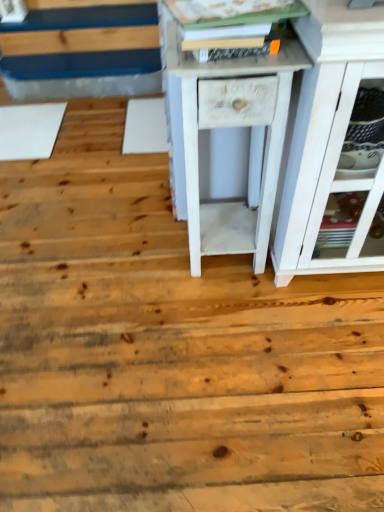
You are a GUI agent. You are given a task and a screenshot of the screen. Output one action in this format:
    pyautogui.click(x=<x>, y=<y>)
    Task: Click on the white matte nightstand at center
    
    Given the screenshot: What is the action you would take?
    (227, 125)

The width and height of the screenshot is (384, 512). Describe the element at coordinates (227, 125) in the screenshot. I see `white matte nightstand at center` at that location.

I want to click on white painted wood cabinet at right, so click(329, 142).

This screenshot has width=384, height=512. Describe the element at coordinates (329, 142) in the screenshot. I see `white painted wood cabinet at right` at that location.

Find the location of a particular element. The image size is (384, 512). white matte nightstand at center is located at coordinates (227, 125).

Can you confirm if white painted wood cabinet at right is positioned to the left of white matte nightstand at center?

No, white painted wood cabinet at right is not to the left of white matte nightstand at center.

Is the position of white painted wood cabinet at right more distant than that of white matte nightstand at center?

No, it is in front of white matte nightstand at center.

Is point (288, 188) positioned before point (190, 53)?

No.

From the image's perspective, which one is positioned lower, white painted wood cabinet at right or white matte nightstand at center?

From the image's view, white matte nightstand at center is below.

From a real-world perspective, is white painted wood cabinet at right on white matte nightstand at center?

Yes, from a real-world perspective, white painted wood cabinet at right is on top of white matte nightstand at center.

Considering the relative sizes of white painted wood cabinet at right and white matte nightstand at center in the image provided, is white painted wood cabinet at right wider than white matte nightstand at center?

Yes, white painted wood cabinet at right is wider than white matte nightstand at center.

Considering the relative sizes of white painted wood cabinet at right and white matte nightstand at center in the image provided, is white painted wood cabinet at right shorter than white matte nightstand at center?

No.

Which of these two, white painted wood cabinet at right or white matte nightstand at center, is bigger?

white painted wood cabinet at right is bigger.

Is white painted wood cabinet at right outside of white matte nightstand at center?

Yes, white painted wood cabinet at right is located beyond the bounds of white matte nightstand at center.

Is white painted wood cabinet at right placed right next to white matte nightstand at center?

No, white painted wood cabinet at right is not beside white matte nightstand at center.

Is white painted wood cabinet at right turned away from white matte nightstand at center?

white painted wood cabinet at right is not turned away from white matte nightstand at center.

Can you tell me how much white painted wood cabinet at right and white matte nightstand at center differ in facing direction?

There is a 0.000612-degree angle between the facing directions of white painted wood cabinet at right and white matte nightstand at center.

In order to click on nightstand behind the white painted wood cabinet at right in this screenshot , I will do `click(227, 125)`.

Considering the relative positions of white matte nightstand at center and white painted wood cabinet at right in the image provided, is white matte nightstand at center to the right of white painted wood cabinet at right from the viewer's perspective?

In fact, white matte nightstand at center is to the left of white painted wood cabinet at right.

Which object is further away from the camera taking this photo, white matte nightstand at center or white painted wood cabinet at right?

Positioned behind is white matte nightstand at center.

Which point is more distant from viewer, (x=225, y=13) or (x=328, y=269)?

Answer: The point (x=328, y=269) is farther.

From the image's perspective, who appears lower, white matte nightstand at center or white painted wood cabinet at right?

white matte nightstand at center is shown below in the image.

From a real-world perspective, which is physically above, white matte nightstand at center or white painted wood cabinet at right?

white painted wood cabinet at right is physically above.

Considering the sizes of objects white matte nightstand at center and white painted wood cabinet at right in the image provided, who is wider, white matte nightstand at center or white painted wood cabinet at right?

With larger width is white painted wood cabinet at right.

Can you confirm if white matte nightstand at center is shorter than white painted wood cabinet at right?

Indeed, white matte nightstand at center has a lesser height compared to white painted wood cabinet at right.

Considering the relative sizes of white matte nightstand at center and white painted wood cabinet at right in the image provided, is white matte nightstand at center smaller than white painted wood cabinet at right?

Yes, white matte nightstand at center is smaller than white painted wood cabinet at right.

Is white matte nightstand at center surrounding white painted wood cabinet at right?

That's incorrect, white painted wood cabinet at right is not inside white matte nightstand at center.

Is white matte nightstand at center next to white painted wood cabinet at right?

There is a gap between white matte nightstand at center and white painted wood cabinet at right.

Is white matte nightstand at center facing away from white painted wood cabinet at right?

No.

How many degrees apart are the facing directions of white matte nightstand at center and white painted wood cabinet at right?

The facing directions of white matte nightstand at center and white painted wood cabinet at right are 0.000612 degrees apart.

Where is `nightstand behind the white painted wood cabinet at right`? The width and height of the screenshot is (384, 512). nightstand behind the white painted wood cabinet at right is located at coordinates (227, 125).

Identify the location of the chest of drawers located above the white matte nightstand at center (from a real-world perspective). The image size is (384, 512). (329, 142).

Where is `chest of drawers that is on the right side of white matte nightstand at center`? The width and height of the screenshot is (384, 512). chest of drawers that is on the right side of white matte nightstand at center is located at coordinates (329, 142).